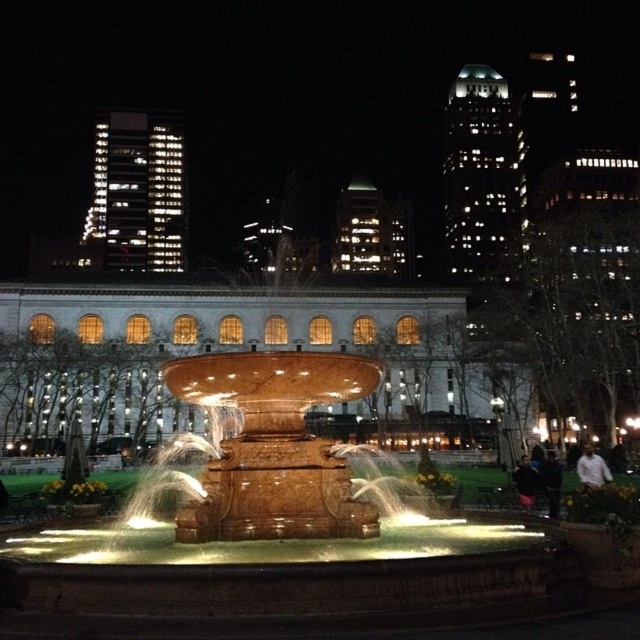
You are standing at the edge of the fountain and want to grab your jacket. The white cotton shirt at lower right and the dark blue fabric jacket at lower right are both on the ground. If you can reach items up to 20 feet away, can you reach both items without moving?

The white cotton shirt at lower right is 20.28 feet away from dark blue fabric jacket at lower right. Since your maximum reach is 20 feet, you cannot reach the white cotton shirt at lower right because it is slightly farther than your reach limit.

You are standing in front of the fountain and see both the white cotton shirt at lower right and the dark blue fabric jacket at lower right. Which one is taller?

The white cotton shirt at lower right is much taller as dark blue fabric jacket at lower right.

You are standing at the edge of the fountain and see the dark blue jeans at lower right and the white cotton shirt at lower right. Which clothing item is closer to the ground?

The dark blue jeans at lower right is positioned under the white cotton shirt at lower right, so it is closer to the ground.